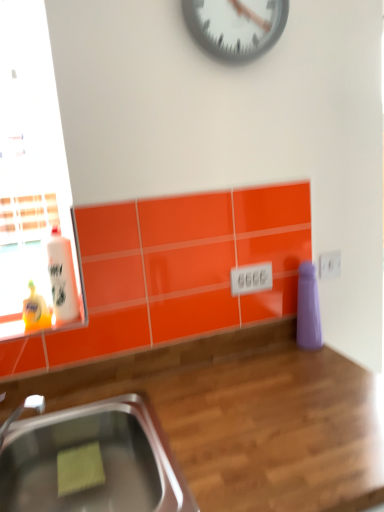
Question: Is wooden at lower right situated inside stainless steel sink at lower left or outside?

Choices:
 (A) outside
 (B) inside

Answer: (A)

Question: From the image's perspective, relative to stainless steel sink at lower left, is wooden at lower right above or below?

Choices:
 (A) above
 (B) below

Answer: (B)

Question: Estimate the real-world distances between objects in this image. Which object is closer to the wooden at lower right?

Choices:
 (A) metallic gray clock at upper center
 (B) white glossy bottle at left
 (C) stainless steel sink at lower left

Answer: (C)

Question: Which object is positioned closest to the stainless steel sink at lower left?

Choices:
 (A) metallic gray clock at upper center
 (B) white glossy bottle at left
 (C) wooden at lower right

Answer: (C)